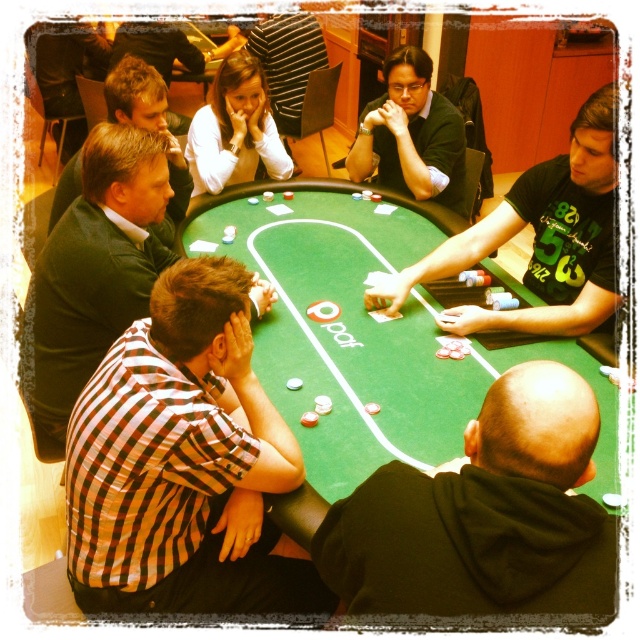
You are a photographer standing behind the dealer at the poker table. You want to take a photo of both the checkered fabric shirt at lower left and the checkered shirt at center without any overlap. Which shirt should you move closer to the camera to ensure the other fits into the frame?

To avoid overlap, move the checkered shirt at center closer to the camera since the checkered fabric shirt at lower left might be wider than the checkered shirt at center, making it take up more space in the frame.

You are sitting at the poker table and want to pass a note to the player in the checkered fabric shirt at lower left and the green jersey at center. Which player can you reach without moving from your seat?

The checkered fabric shirt at lower left is closer to the viewer than the green jersey at center, so you can reach the player in the checkered fabric shirt at lower left without moving from your seat.

You are a photographer positioned behind the dealer at the poker table. You need to take a photo of both the checkered fabric shirt at lower left and the green jersey at center. Which one will appear taller in the photo?

The checkered fabric shirt at lower left will appear taller in the photo because it has a greater height compared to the green jersey at center.